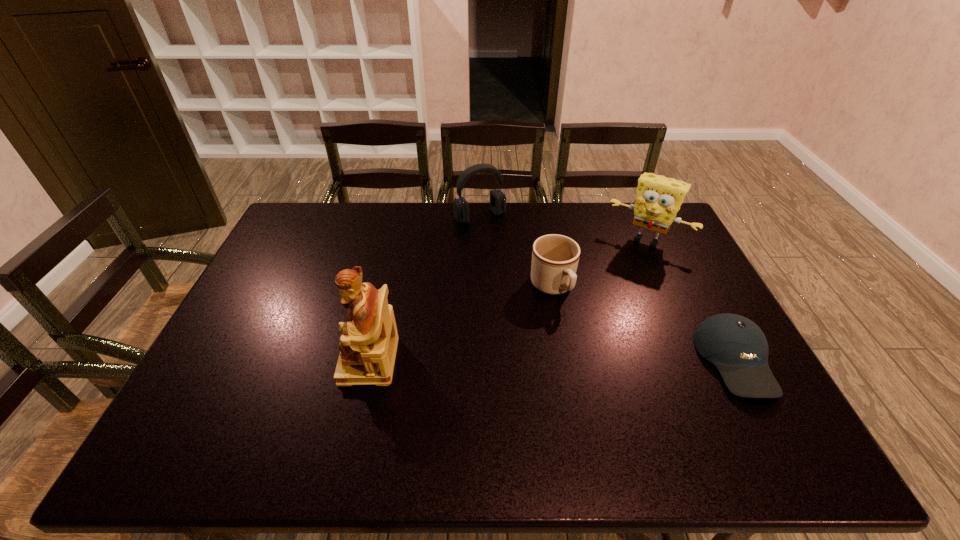
This screenshot has height=540, width=960. What are the coordinates of `vacant area that lies between the fourth tallest object and the shortest object` in the screenshot? It's located at (644, 323).

Locate an element on the screen. The width and height of the screenshot is (960, 540). empty location between the headset and the fourth tallest object is located at coordinates (516, 252).

The image size is (960, 540). I want to click on free space between the baseball cap and the sponge, so click(691, 300).

Locate an element on the screen. object that ranks as the fourth closest to the third farthest object is located at coordinates (368, 345).

Where is `object that stands as the second closest to the sponge`? object that stands as the second closest to the sponge is located at coordinates (738, 348).